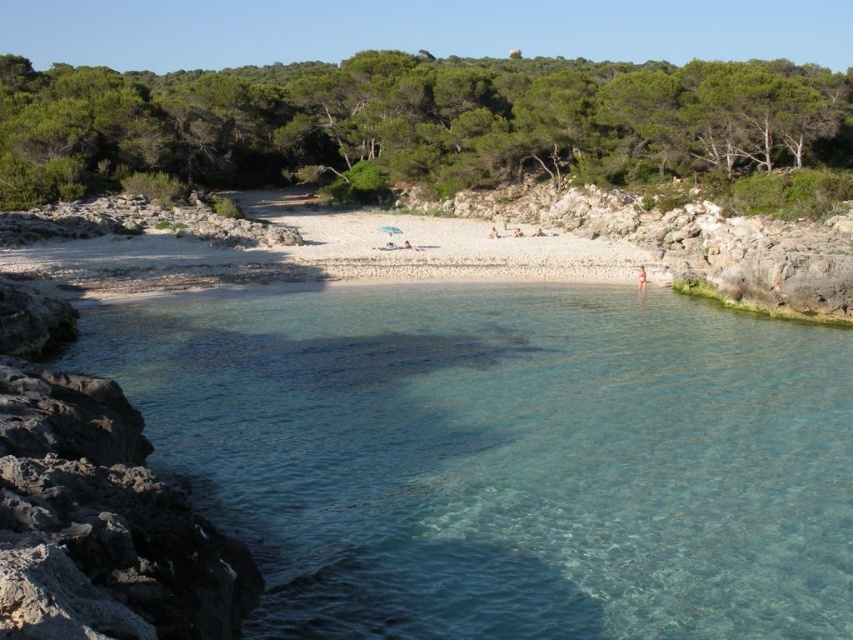
Which is in front, point (306, 394) or point (480, 225)?

Point (306, 394) is more forward.

At what (x,y) coordinates should I click in order to perform the action: click on clear glass water at center. Please return your answer as a coordinate pair (x, y). Looking at the image, I should click on (503, 458).

Between point (695, 452) and point (358, 212), which one is positioned in front?

Positioned in front is point (695, 452).

Where is `clear glass water at center`? Image resolution: width=853 pixels, height=640 pixels. clear glass water at center is located at coordinates (503, 458).